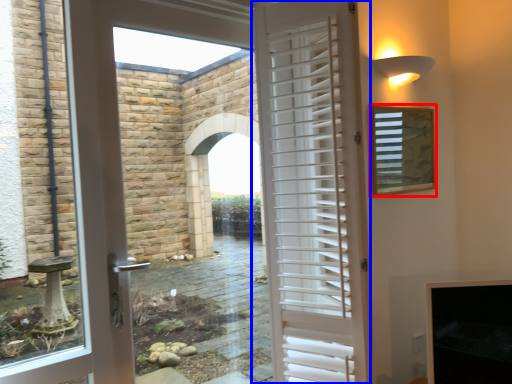
Question: Which object is further to the camera taking this photo, window screen (highlighted by a red box) or door (highlighted by a blue box)?

Choices:
 (A) window screen
 (B) door

Answer: (A)